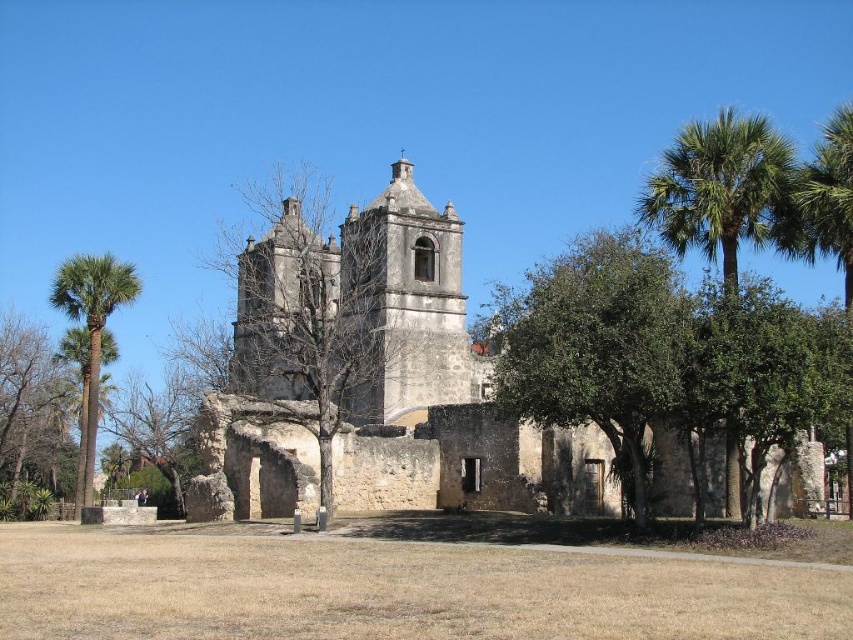
Question: Among these objects, which one is farthest from the camera?

Choices:
 (A) green leafy tree at center
 (B) green leafy palm tree at right
 (C) brown rough stone tower at center

Answer: (C)

Question: Which is farther from the brown stone church at center?

Choices:
 (A) brown rough stone tower at center
 (B) green leafy tree at center
 (C) green leafy palm at left

Answer: (C)

Question: Is green leafy palm tree at right wider than green leafy palm at left?

Choices:
 (A) yes
 (B) no

Answer: (B)

Question: Can you confirm if green leafy tree at center is bigger than brown rough stone tower at center?

Choices:
 (A) no
 (B) yes

Answer: (B)

Question: From the image, what is the correct spatial relationship of brown stone church at center in relation to green leafy palm at left?

Choices:
 (A) left
 (B) right

Answer: (B)

Question: Which of the following is the closest to the observer?

Choices:
 (A) brown stone church at center
 (B) green leafy tree at center

Answer: (B)